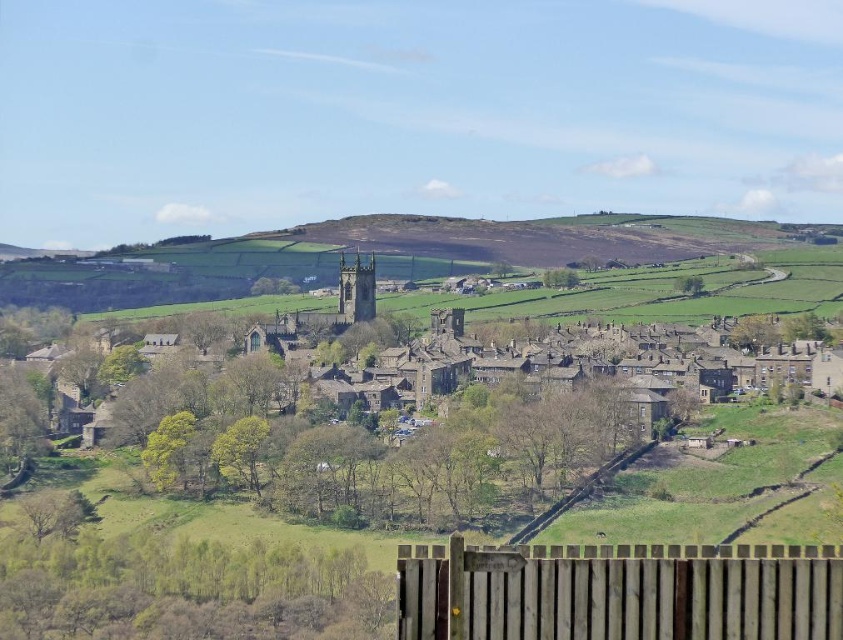
Question: Does brown stone buildings at center have a larger size compared to brown wooden fence at lower center?

Choices:
 (A) no
 (B) yes

Answer: (B)

Question: Is brown stone buildings at center positioned in front of brown wooden fence at lower center?

Choices:
 (A) no
 (B) yes

Answer: (A)

Question: Among these objects, which one is farthest from the camera?

Choices:
 (A) brown stone buildings at center
 (B) brown wooden fence at lower center

Answer: (A)

Question: Can you confirm if brown stone buildings at center is positioned below brown wooden fence at lower center?

Choices:
 (A) yes
 (B) no

Answer: (B)

Question: Which point is farther to the camera?

Choices:
 (A) (639, 573)
 (B) (619, 397)

Answer: (B)